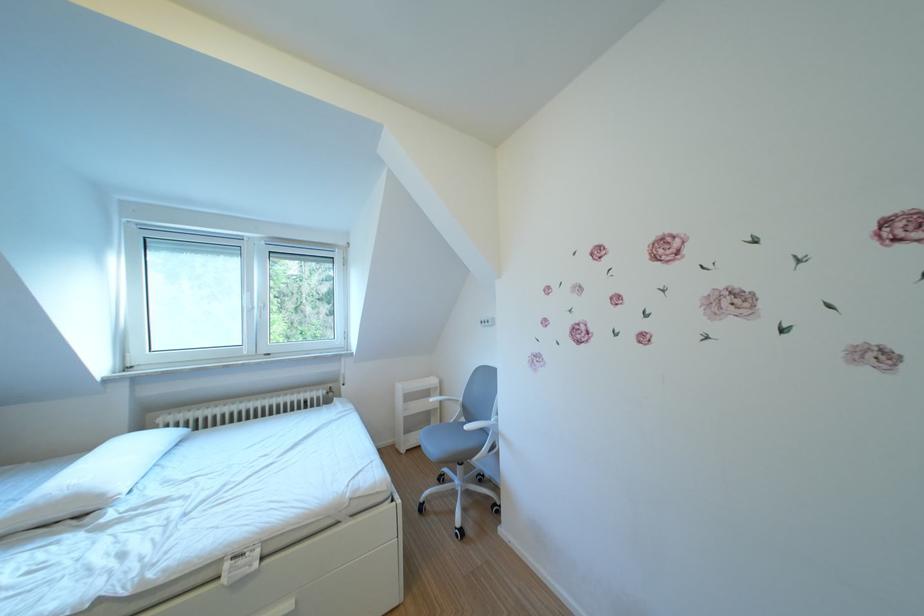
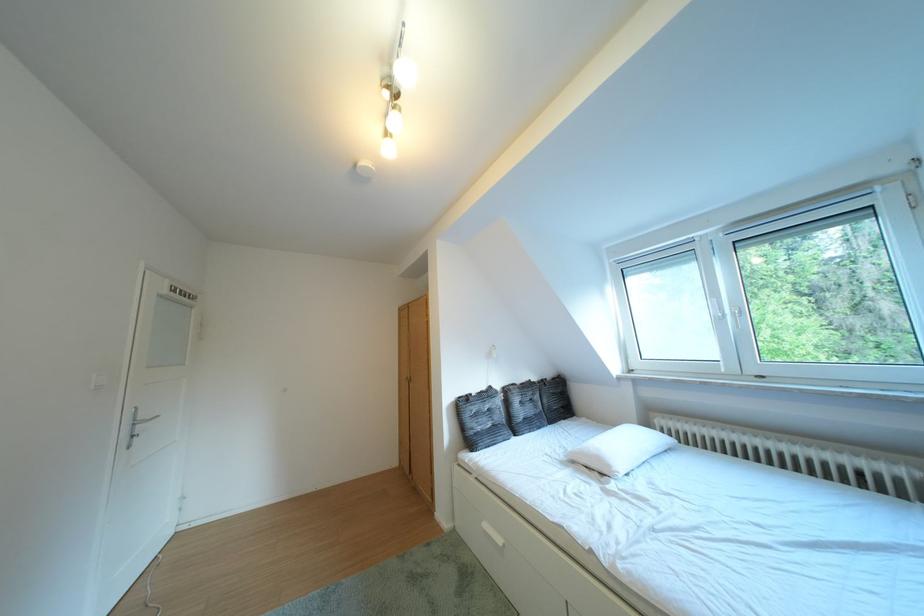
The point at [115,501] is marked in the first image. Where is the corresponding point in the second image?

(623, 471)